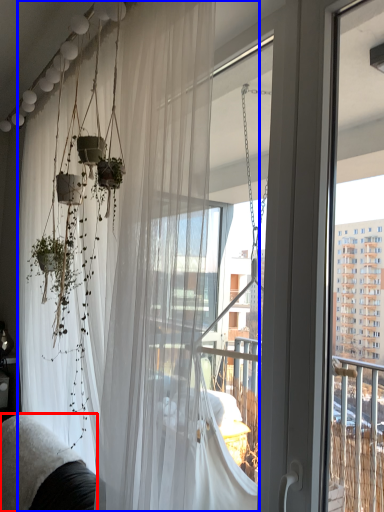
Question: Which object is closer to the camera taking this photo, couch (highlighted by a red box) or curtain (highlighted by a blue box)?

Choices:
 (A) couch
 (B) curtain

Answer: (B)